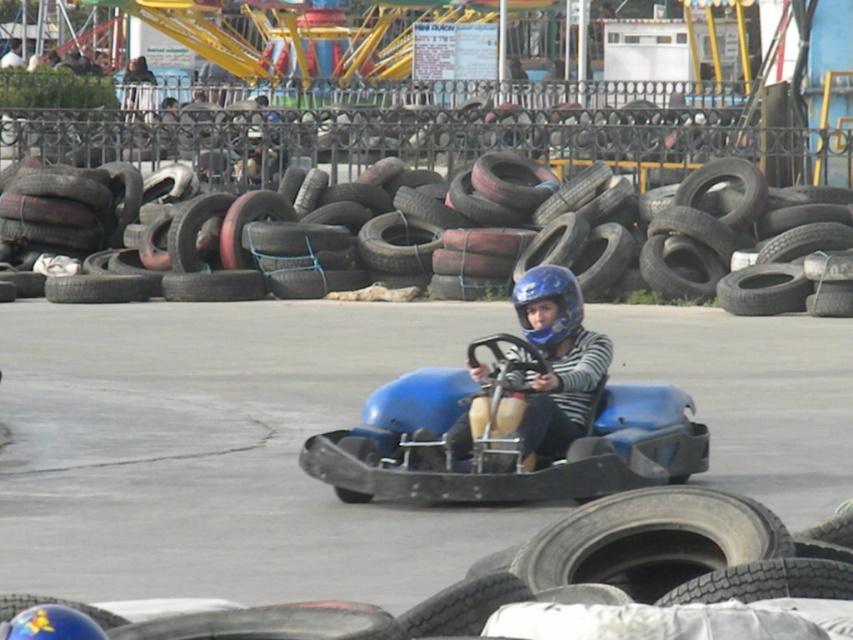
Does point (689, 518) lie behind point (514, 289)?

No, (689, 518) is closer to viewer.

Is black rubber tire at lower right taller than blue matte helmet at center?

Indeed, black rubber tire at lower right has a greater height compared to blue matte helmet at center.

Where is `black rubber tire at lower right`? black rubber tire at lower right is located at coordinates (650, 540).

Is blue matte go-kart at center positioned behind blue matte helmet at center?

No, it is in front of blue matte helmet at center.

Describe the element at coordinates (503, 438) in the screenshot. I see `blue matte go-kart at center` at that location.

Find the location of a particular element. Image resolution: width=853 pixels, height=640 pixels. blue matte go-kart at center is located at coordinates (503, 438).

Which is behind, point (387, 160) or point (549, 333)?

Positioned behind is point (387, 160).

Does black rubber tire at center appear on the right side of blue matte helmet at center?

Indeed, black rubber tire at center is positioned on the right side of blue matte helmet at center.

Is point (635, 218) positioned behind point (532, 289)?

Yes, point (635, 218) is behind point (532, 289).

The image size is (853, 640). I want to click on black rubber tire at center, so click(x=490, y=230).